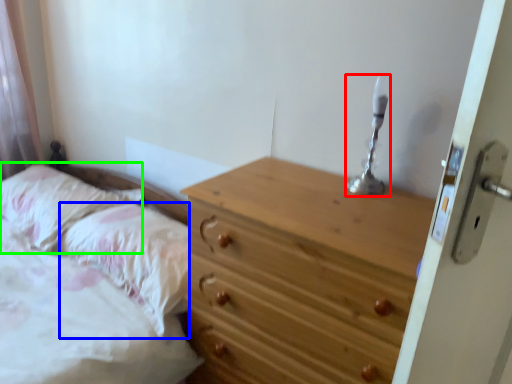
Question: Considering the real-world distances, which object is closest to candle holder (highlighted by a red box)? pillow (highlighted by a blue box) or pillow (highlighted by a green box).

Choices:
 (A) pillow
 (B) pillow

Answer: (A)